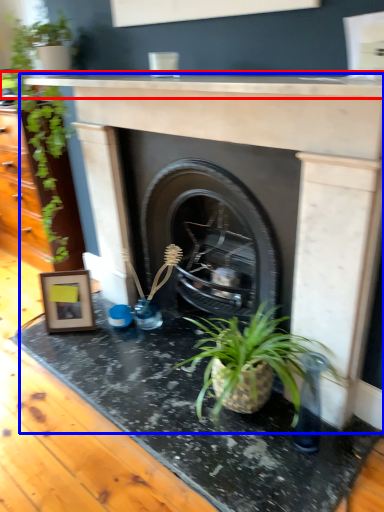
Question: Among these objects, which one is farthest to the camera, counter top (highlighted by a red box) or fireplace (highlighted by a blue box)?

Choices:
 (A) counter top
 (B) fireplace

Answer: (B)